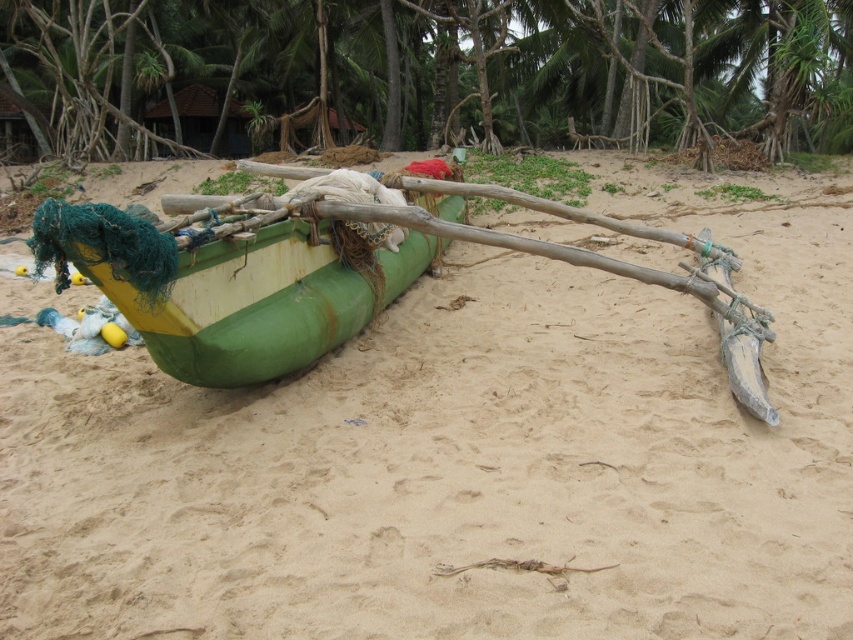
You are standing on the beach and want to take a photo of the green leafy tree at upper center and the green rubber boat at center. Which object should you zoom in on to make sure both fit in the frame?

The green leafy tree at upper center might be wider than the green rubber boat at center, so you should zoom out to ensure both fit in the frame.

You are standing on the sandy beach where the boat is resting. You want to walk directly towards the green leafy tree at upper center. Which direction should you head?

The green leafy tree at upper center is located at point (x=428, y=72), so you should head towards the upper left direction to reach it.

You are standing on the beach and want to take a photo of the green rubber boat at center without the green leafy tree at upper center blocking the view. Which direction should you move to ensure the tree is out of the frame?

Move to the right side of the green rubber boat at center so the green leafy tree at upper center is no longer blocking the view.